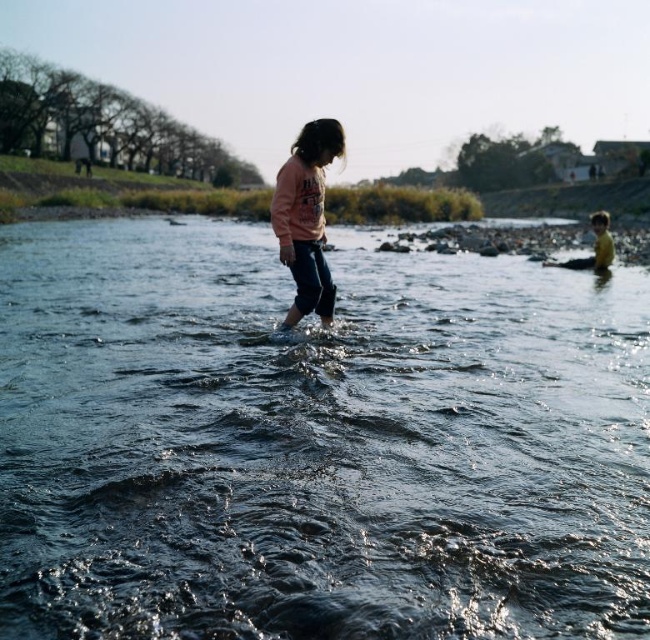
Describe the element at coordinates (315, 442) in the screenshot. The image size is (650, 640). I see `clear water at center` at that location.

Which of these two, clear water at center or yellow rubber boots at right, stands shorter?

clear water at center is shorter.

Which is in front, point (261, 513) or point (593, 212)?

Point (261, 513) is more forward.

Where is `clear water at center`? The image size is (650, 640). clear water at center is located at coordinates (315, 442).

Which is above, clear water at center or pink fleece sweater at center?

pink fleece sweater at center is higher up.

Who is more distant from viewer, (x=432, y=621) or (x=291, y=262)?

The point (x=291, y=262) is more distant.

The width and height of the screenshot is (650, 640). Find the location of `clear water at center`. clear water at center is located at coordinates (315, 442).

Can you confirm if pink fleece sweater at center is smaller than yellow rubber boots at right?

Yes.

Looking at this image, is pink fleece sweater at center above yellow rubber boots at right?

Incorrect, pink fleece sweater at center is not positioned above yellow rubber boots at right.

Locate an element on the screen. This screenshot has height=640, width=650. pink fleece sweater at center is located at coordinates (306, 218).